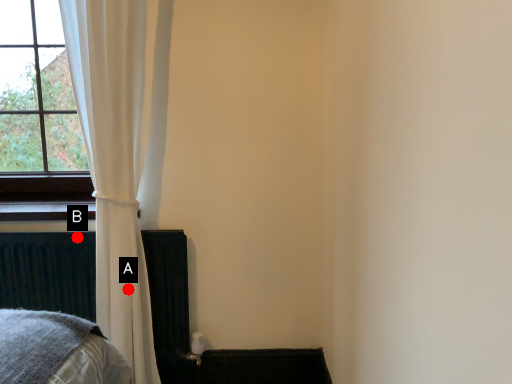
Question: Two points are circled on the image, labeled by A and B beside each circle. Which point is farther to the camera?

Choices:
 (A) A is further
 (B) B is further

Answer: (B)